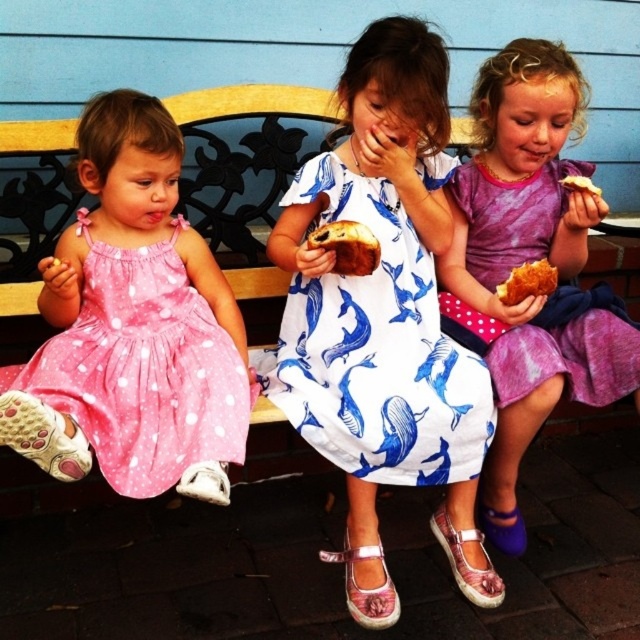
Question: Which point is closer to the camera?

Choices:
 (A) golden brown bread at center
 (B) pink polka dot fabric dress at left
 (C) purple satin dress at right
 (D) golden crispy pastry at center

Answer: (B)

Question: Among these objects, which one is farthest from the camera?

Choices:
 (A) purple satin dress at center
 (B) golden crispy bread at center
 (C) purple satin dress at right
 (D) golden crispy pastry at center

Answer: (B)

Question: Does purple satin dress at right appear under golden crispy pastry at center?

Choices:
 (A) no
 (B) yes

Answer: (B)

Question: Estimate the real-world distances between objects in this image. Which object is closer to the golden crispy pastry at center?

Choices:
 (A) purple satin dress at right
 (B) pink polka dot fabric dress at left

Answer: (A)

Question: Is purple satin dress at right to the left of golden crispy pastry at center from the viewer's perspective?

Choices:
 (A) no
 (B) yes

Answer: (B)

Question: In this image, where is pink polka dot fabric dress at left located relative to golden crispy bread at center?

Choices:
 (A) right
 (B) left

Answer: (B)